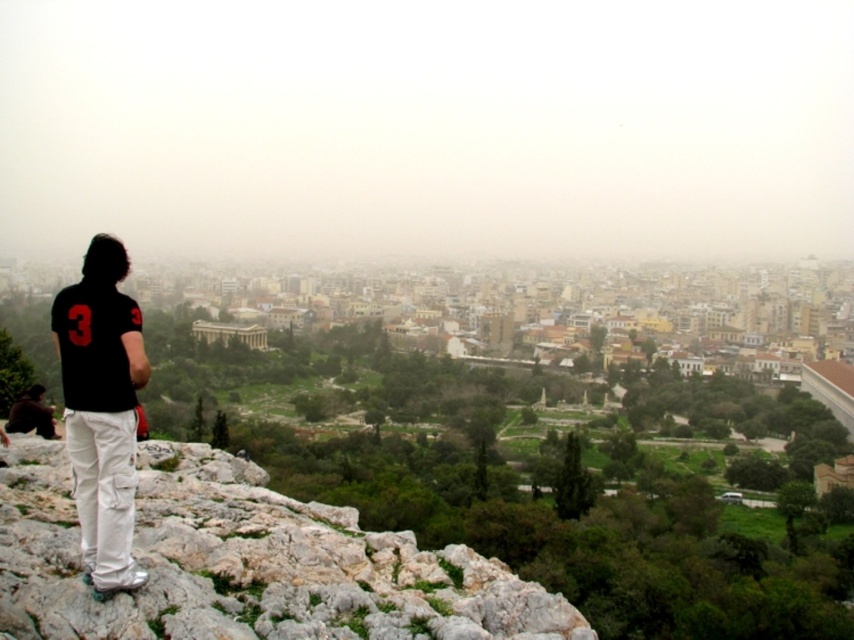
Question: Observing the image, what is the correct spatial positioning of black cotton shirt at left in reference to dark brown leather jacket at lower left?

Choices:
 (A) below
 (B) above

Answer: (B)

Question: Among these points, which one is farthest from the camera?

Choices:
 (A) pyautogui.click(x=20, y=412)
 (B) pyautogui.click(x=114, y=257)

Answer: (A)

Question: Among these points, which one is nearest to the camera?

Choices:
 (A) (32, 392)
 (B) (80, 326)

Answer: (B)

Question: Considering the relative positions of black cotton shirt at left and dark brown leather jacket at lower left in the image provided, where is black cotton shirt at left located with respect to dark brown leather jacket at lower left?

Choices:
 (A) above
 (B) below

Answer: (A)

Question: In this image, where is black cotton shirt at left located relative to dark brown leather jacket at lower left?

Choices:
 (A) left
 (B) right

Answer: (B)